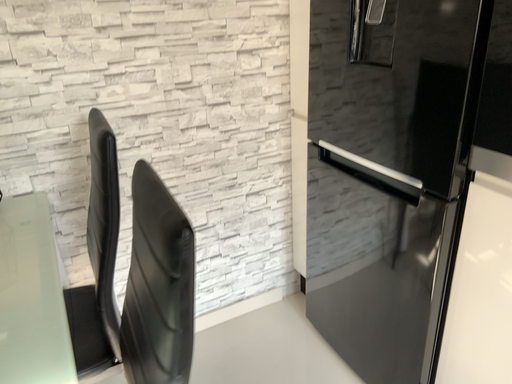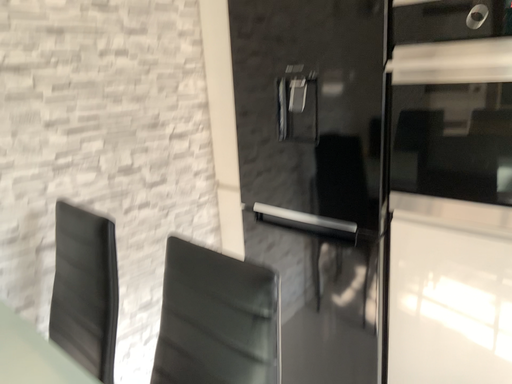
Question: How did the camera likely rotate when shooting the video?

Choices:
 (A) rotated upward
 (B) rotated downward

Answer: (A)